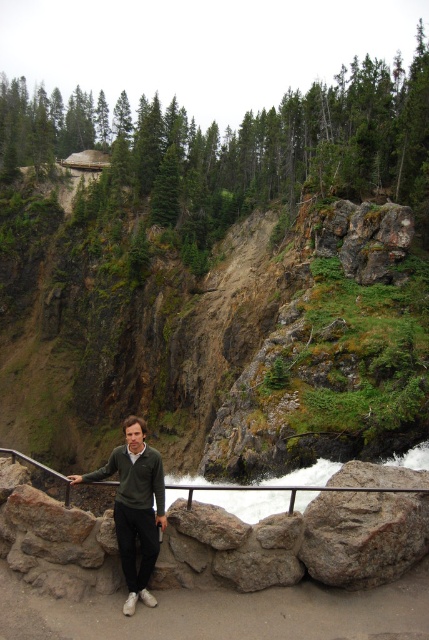
Does dark green sweater at center have a larger size compared to black metal/rail at lower center?

Actually, dark green sweater at center might be smaller than black metal/rail at lower center.

Can you confirm if dark green sweater at center is positioned below black metal/rail at lower center?

Actually, dark green sweater at center is above black metal/rail at lower center.

Does point (145, 515) lie behind point (290, 512)?

No.

Locate an element on the screen. dark green sweater at center is located at coordinates (135, 508).

Is point (350, 220) more distant than point (30, 460)?

No, (350, 220) is closer to viewer.

Does point (263, 312) come in front of point (299, 484)?

No, it is not.

The height and width of the screenshot is (640, 429). In order to click on green mossy rock at upper center in this screenshot , I will do `click(233, 352)`.

Does point (371, 275) come closer to viewer compared to point (126, 536)?

That is False.

At what (x,y) coordinates should I click in order to perform the action: click on green mossy rock at upper center. Please return your answer as a coordinate pair (x, y). The image size is (429, 640). Looking at the image, I should click on (233, 352).